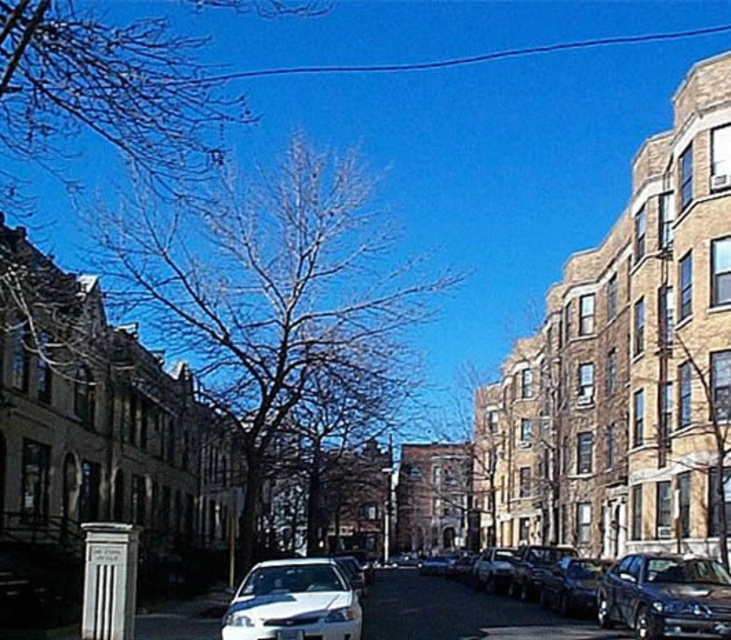
Question: Does shiny silver sedan at center appear on the right side of white glossy car at center?

Choices:
 (A) yes
 (B) no

Answer: (A)

Question: Is shiny silver sedan at center further to camera compared to white glossy car at center?

Choices:
 (A) no
 (B) yes

Answer: (B)

Question: Estimate the real-world distances between objects in this image. Which object is closer to the shiny silver sedan at center?

Choices:
 (A) white glossy car at center
 (B) shiny black sedan at lower right

Answer: (B)

Question: Which point is farther to the camera?

Choices:
 (A) (647, 579)
 (B) (481, 618)

Answer: (B)

Question: Does shiny silver sedan at center appear over shiny black sedan at lower right?

Choices:
 (A) yes
 (B) no

Answer: (B)

Question: Among these objects, which one is farthest from the camera?

Choices:
 (A) shiny silver sedan at center
 (B) shiny black sedan at lower right

Answer: (A)